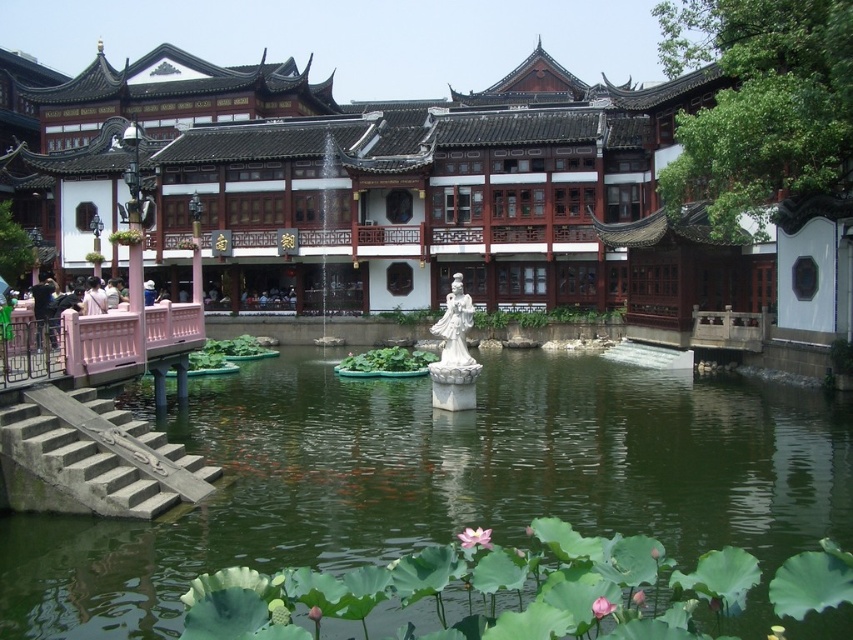
Question: Can you confirm if green water at center is wider than white marble statue at center?

Choices:
 (A) yes
 (B) no

Answer: (A)

Question: Which of the following is the farthest from the observer?

Choices:
 (A) concrete stairs at lower left
 (B) smooth white statue at center
 (C) green water at center

Answer: (B)

Question: Estimate the real-world distances between objects in this image. Which object is closer to the smooth white statue at center?

Choices:
 (A) concrete stairs at lower left
 (B) green water at center

Answer: (B)

Question: Which object is the farthest from the concrete stairs at lower left?

Choices:
 (A) smooth white statue at center
 (B) green water at center
 (C) white marble statue at center

Answer: (A)

Question: Is smooth white statue at center thinner than white marble statue at center?

Choices:
 (A) no
 (B) yes

Answer: (A)

Question: Is green water at center to the right of white marble statue at center from the viewer's perspective?

Choices:
 (A) no
 (B) yes

Answer: (A)